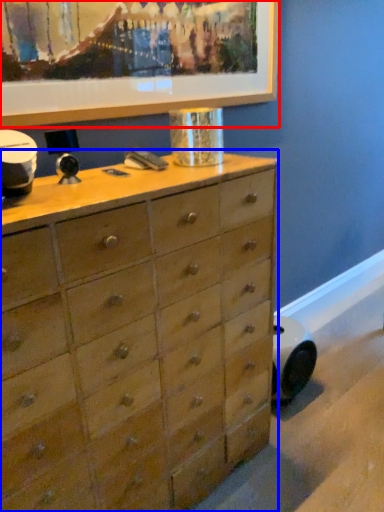
Question: Among these objects, which one is nearest to the camera, picture frame (highlighted by a red box) or chest of drawers (highlighted by a blue box)?

Choices:
 (A) picture frame
 (B) chest of drawers

Answer: (B)